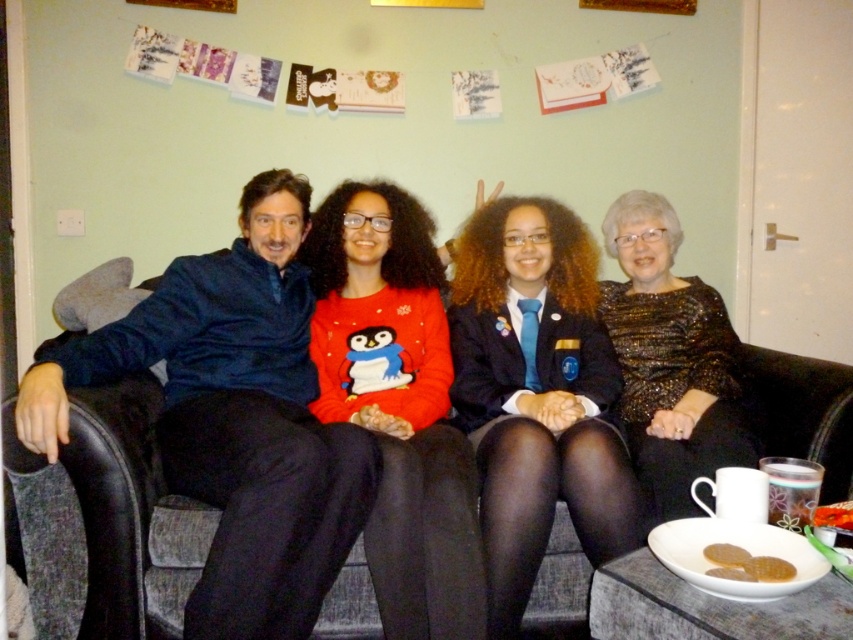
Can you confirm if blue fleece jacket at left is positioned below dark gray fabric couch at center?

No.

Which is behind, point (244, 196) or point (77, 449)?

The point (244, 196) is behind.

Who is more distant from viewer, (287, 380) or (799, 356)?

The point (799, 356) is behind.

What are the coordinates of `blue fleece jacket at left` in the screenshot? It's located at (234, 419).

Can you confirm if blue fleece jacket at left is wider than matte red sweater at center?

Yes.

Between blue fleece jacket at left and matte red sweater at center, which one has more height?

Standing taller between the two is matte red sweater at center.

Which is in front, point (300, 547) or point (438, 317)?

Point (300, 547) is in front.

You are a GUI agent. You are given a task and a screenshot of the screen. Output one action in this format:
    pyautogui.click(x=<x>, y=<y>)
    Task: Click on the blue fleece jacket at left
    
    Given the screenshot: What is the action you would take?
    pyautogui.click(x=234, y=419)

Is blue satin blazer at center further to the viewer compared to matte red sweater at center?

Yes, it is behind matte red sweater at center.

Can you confirm if blue satin blazer at center is bigger than matte red sweater at center?

No.

You are a GUI agent. You are given a task and a screenshot of the screen. Output one action in this format:
    pyautogui.click(x=<x>, y=<y>)
    Task: Click on the blue satin blazer at center
    The image size is (853, 640).
    Given the screenshot: What is the action you would take?
    pyautogui.click(x=537, y=394)